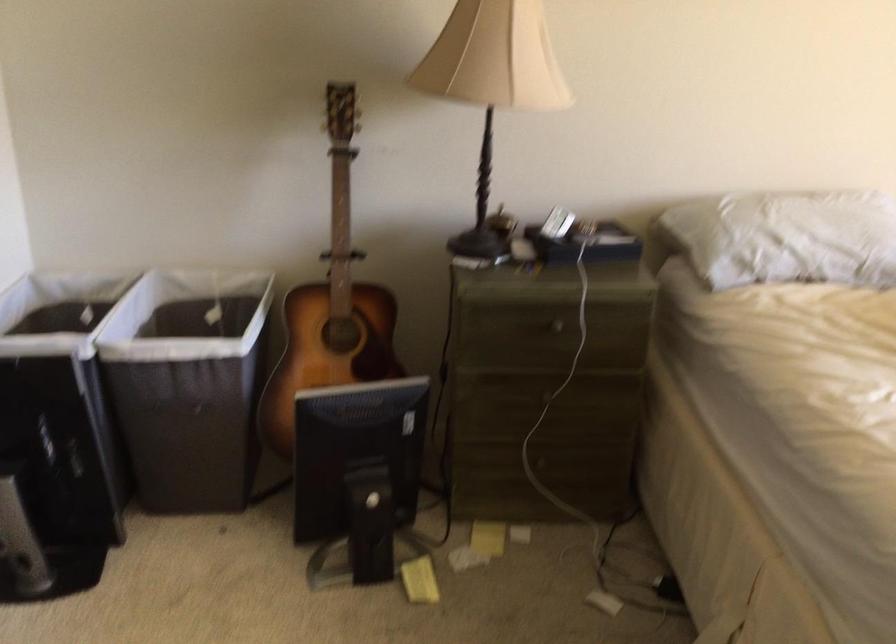
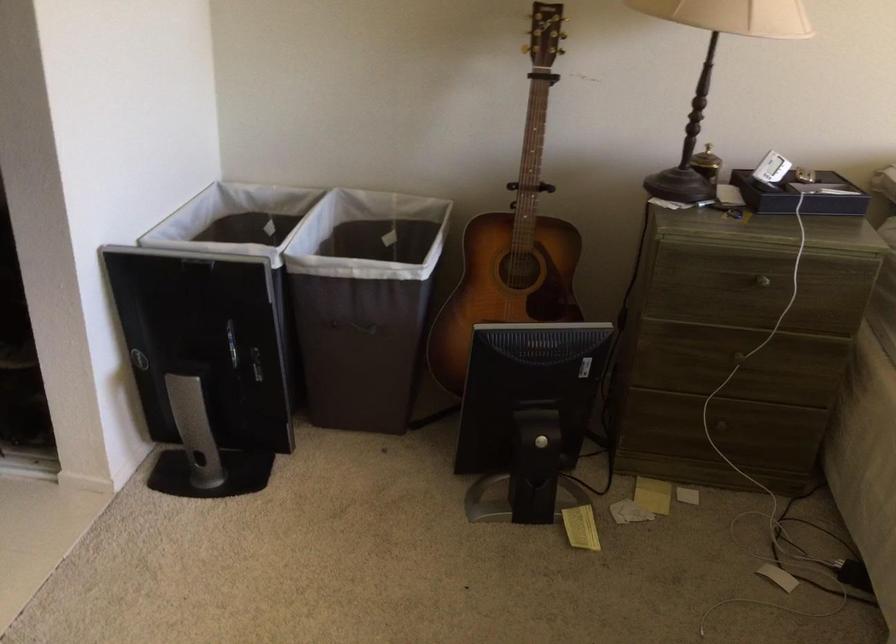
Locate, in the second image, the point that corresponds to (549,398) in the first image.

(738, 357)